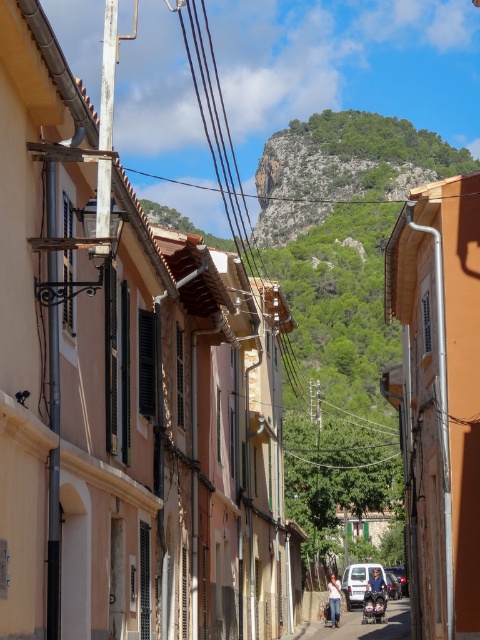
Between point (361, 596) and point (389, 566), which one is positioned in front?

Point (361, 596) is in front.

Who is more distant from viewer, (x=361, y=573) or (x=405, y=586)?

The point (x=405, y=586) is more distant.

The height and width of the screenshot is (640, 480). Find the location of `matte silver car at center`. matte silver car at center is located at coordinates (359, 580).

Can you confirm if metallic silver motorcycle at center is bigger than metallic silver car at center?

Actually, metallic silver motorcycle at center might be smaller than metallic silver car at center.

Does metallic silver motorcycle at center appear under metallic silver car at center?

Incorrect, metallic silver motorcycle at center is not positioned below metallic silver car at center.

Is point (384, 598) closer to viewer compared to point (402, 592)?

Yes, point (384, 598) is closer to viewer.

The width and height of the screenshot is (480, 640). I want to click on metallic silver motorcycle at center, so (374, 602).

Can you confirm if matte silver car at center is bigger than metallic silver motorcycle at center?

Yes.

Who is shorter, matte silver car at center or metallic silver motorcycle at center?

metallic silver motorcycle at center

Is point (347, 589) behind point (363, 612)?

Yes, point (347, 589) is behind point (363, 612).

You are a GUI agent. You are given a task and a screenshot of the screen. Output one action in this format:
    pyautogui.click(x=<x>, y=<y>)
    Task: Click on the matte silver car at center
    This screenshot has height=640, width=480.
    Given the screenshot: What is the action you would take?
    [x=359, y=580]